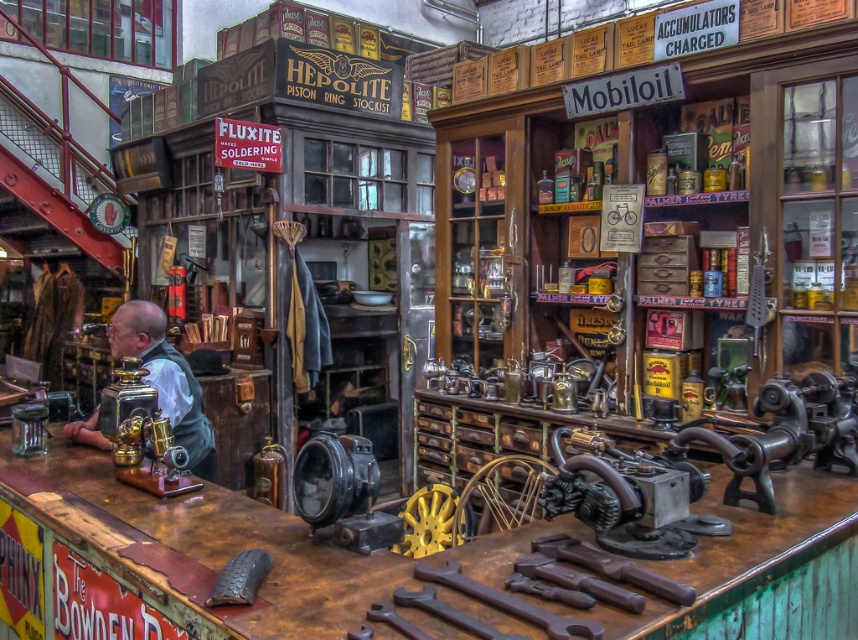
Question: Which of the following is the closest to the observer?

Choices:
 (A) dark brown metal wrenches at center
 (B) rusty metal workbench at center
 (C) gold brass sewing machine at center

Answer: (A)

Question: Which point is farther from the camera taking this photo?

Choices:
 (A) (164, 342)
 (B) (173, 454)
 (C) (710, 483)
 (D) (553, 548)

Answer: (A)

Question: Can you confirm if dark brown metal wrenches at center is positioned above brass/bronze steampunk device at left?

Choices:
 (A) no
 (B) yes

Answer: (A)

Question: Can you confirm if brass/bronze steampunk device at left is positioned below gold brass sewing machine at center?

Choices:
 (A) yes
 (B) no

Answer: (B)

Question: Can you confirm if dark brown metal wrenches at center is positioned to the left of gold brass sewing machine at center?

Choices:
 (A) no
 (B) yes

Answer: (A)

Question: Which point is closer to the camera taking this photo?

Choices:
 (A) (118, 460)
 (B) (53, 508)

Answer: (B)